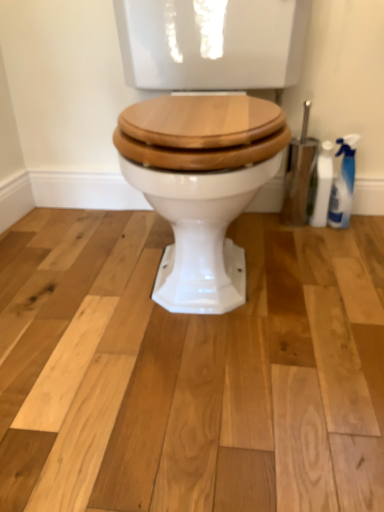
At what (x,y) coordinates should I click in order to perform the action: click on free spot in front of white plastic spray bottle at right, which ranks as the second cleaning product in right-to-left order. Please return your answer as a coordinate pair (x, y). Looking at the image, I should click on [x=324, y=249].